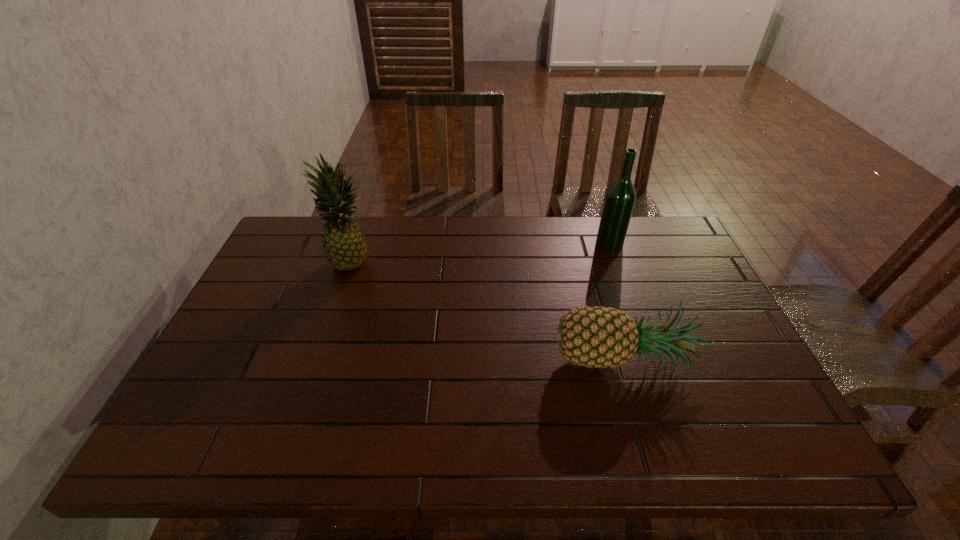
Where is `empty space between the alcohol and the left pineapple`? This screenshot has width=960, height=540. empty space between the alcohol and the left pineapple is located at coordinates pos(480,251).

You are a GUI agent. You are given a task and a screenshot of the screen. Output one action in this format:
    pyautogui.click(x=<x>, y=<y>)
    Task: Click on the free space between the alcohol and the leftmost object
    
    Given the screenshot: What is the action you would take?
    pyautogui.click(x=480, y=251)

The image size is (960, 540). Find the location of `free spot between the alcohol and the shortest object`. free spot between the alcohol and the shortest object is located at coordinates (616, 302).

The image size is (960, 540). In order to click on free space between the alcohol and the farther pineapple in this screenshot , I will do `click(480, 251)`.

This screenshot has width=960, height=540. Identify the location of free area in between the left pineapple and the nearest object. (487, 310).

At what (x,y) coordinates should I click in order to perform the action: click on vacant area between the right pineapple and the alcohol. Please return your answer as a coordinate pair (x, y). This screenshot has width=960, height=540. Looking at the image, I should click on (x=616, y=302).

You are a GUI agent. You are given a task and a screenshot of the screen. Output one action in this format:
    pyautogui.click(x=<x>, y=<y>)
    Task: Click on the free spot between the nearest object and the taller pineapple
    
    Given the screenshot: What is the action you would take?
    pyautogui.click(x=487, y=310)

Image resolution: width=960 pixels, height=540 pixels. I want to click on free space between the alcohol and the nearer pineapple, so click(616, 302).

Locate an element on the screen. The width and height of the screenshot is (960, 540). object that is the second nearest to the alcohol is located at coordinates (345, 248).

Locate which object ranks in proximity to the shortest object. Please provide its 2D coordinates. Your answer should be formatted as a tuple, i.e. [(x, y)], where the tuple contains the x and y coordinates of a point satisfying the conditions above.

[(620, 197)]